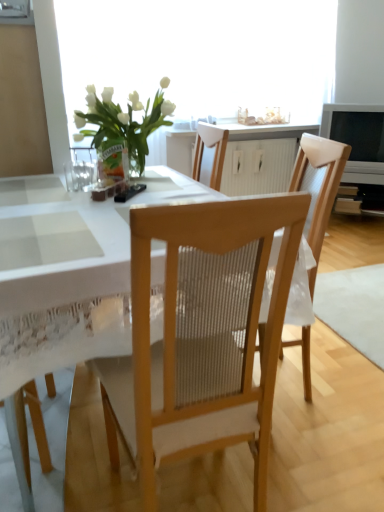
At what (x,y) coordinates should I click in order to perform the action: click on free space behind clear glass vase at center. Please return your answer as a coordinate pair (x, y). The image size is (384, 512). Looking at the image, I should click on (143, 176).